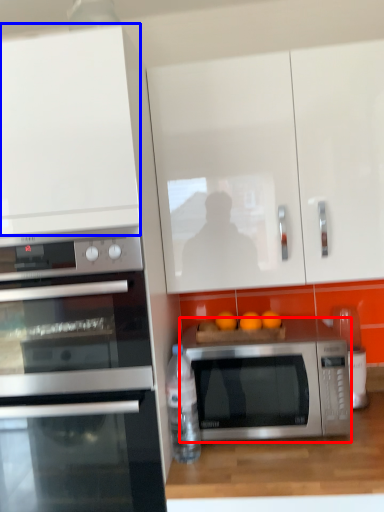
Question: Among these objects, which one is nearest to the camera, microwave oven (highlighted by a red box) or cabinetry (highlighted by a blue box)?

Choices:
 (A) microwave oven
 (B) cabinetry

Answer: (B)